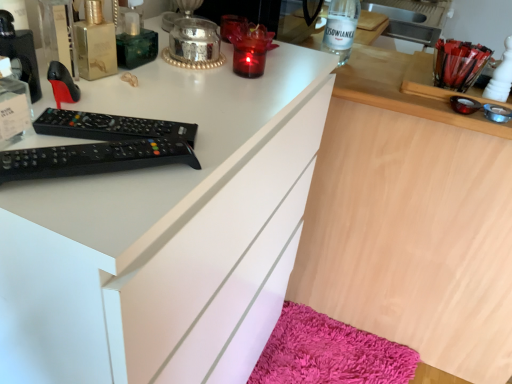
Question: From a real-world perspective, is shaggy pink bath mat at lower right physically located above or below wooden desk at center?

Choices:
 (A) above
 (B) below

Answer: (B)

Question: Is point (311, 326) closer or farther from the camera than point (507, 301)?

Choices:
 (A) farther
 (B) closer

Answer: (A)

Question: Estimate the real-world distances between objects in this image. Which object is farther from the shaggy pink bath mat at lower right?

Choices:
 (A) clear glass bottle at upper center
 (B) wooden desk at center
 (C) white matte cabinet at center
 (D) black plastic remote control at upper left

Answer: (D)

Question: Estimate the real-world distances between objects in this image. Which object is closer to the white matte cabinet at center?

Choices:
 (A) wooden desk at center
 (B) clear glass bottle at upper center
 (C) shaggy pink bath mat at lower right
 (D) black plastic remote control at upper left

Answer: (D)